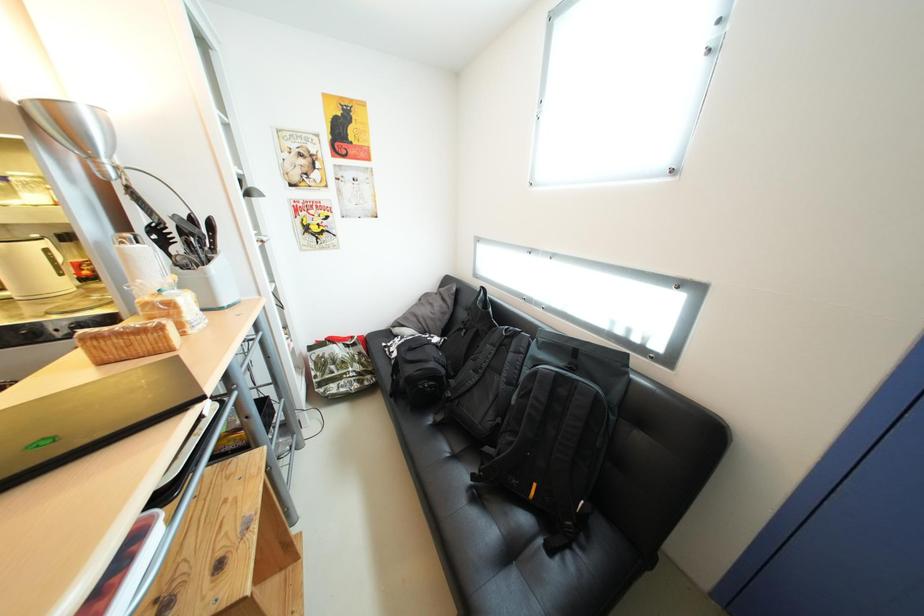
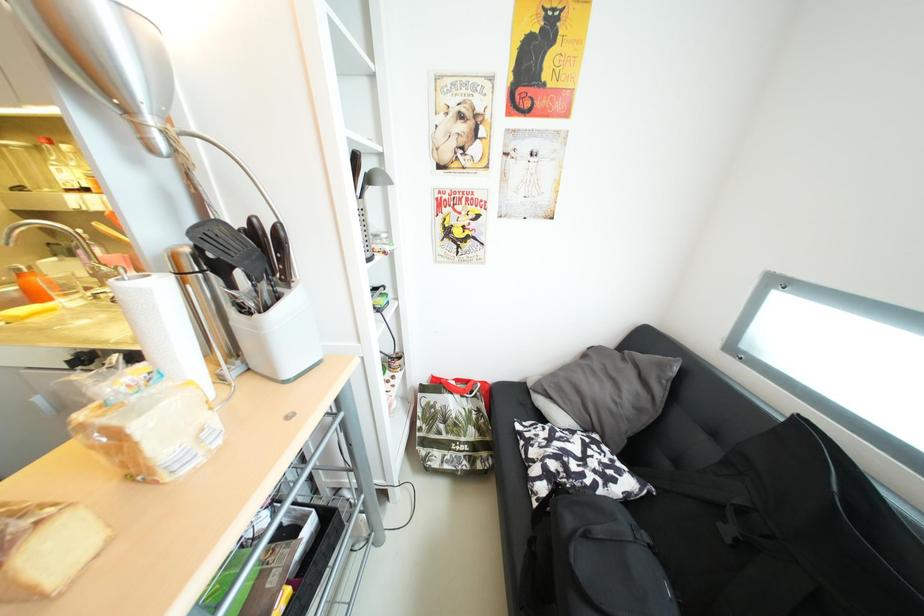
Question: The camera is either moving clockwise (left) or counter-clockwise (right) around the object. The first image is from the beginning of the video and the second image is from the end. Is the camera moving left or right when shooting the video?

Choices:
 (A) Left
 (B) Right

Answer: (B)